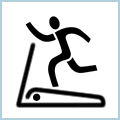
At what (x,y) coordinates should I click in order to perform the action: click on light blue frame. Please return your answer as a coordinate pair (x, y). The image size is (120, 120). Looking at the image, I should click on (0, 40).